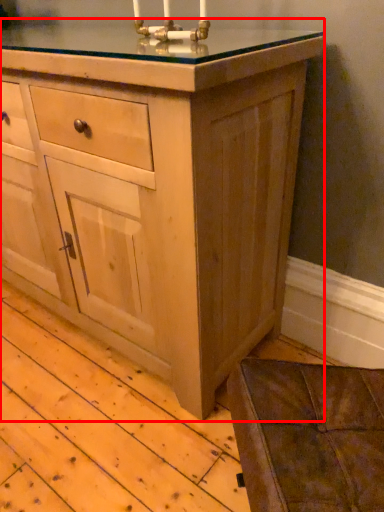
Question: In this image, where is chest of drawers (annotated by the red box) located relative to candle holder?

Choices:
 (A) left
 (B) right

Answer: (A)